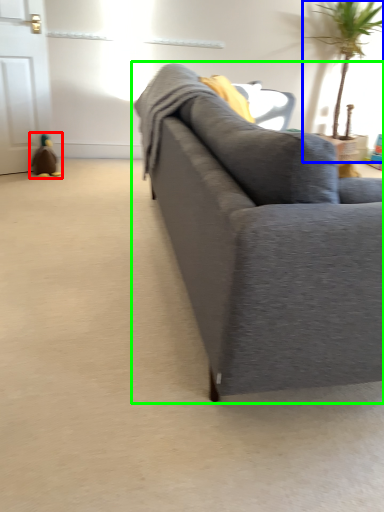
Question: Which object is positioned farthest from toy (highlighted by a red box)? Select from houseplant (highlighted by a blue box) and studio couch (highlighted by a green box).

Choices:
 (A) houseplant
 (B) studio couch

Answer: (A)